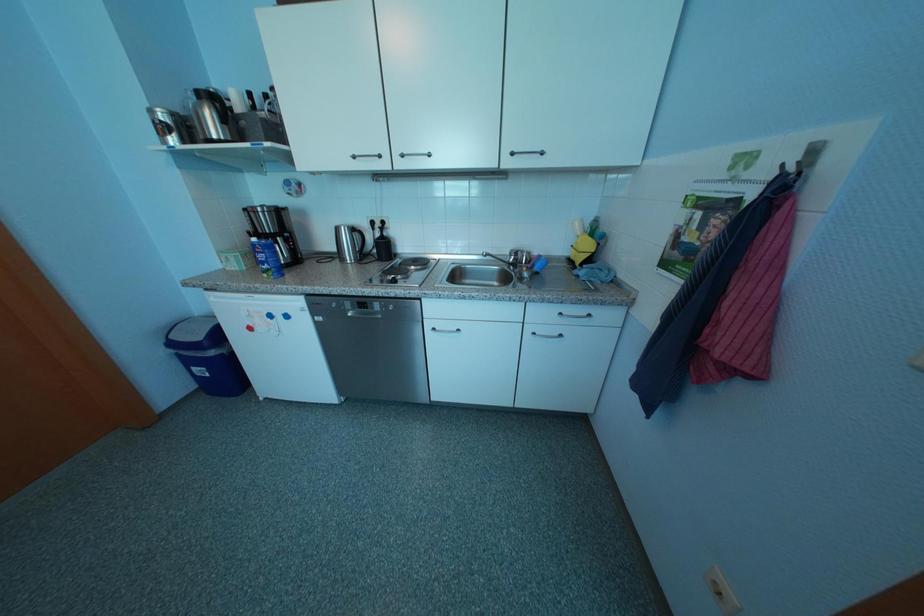
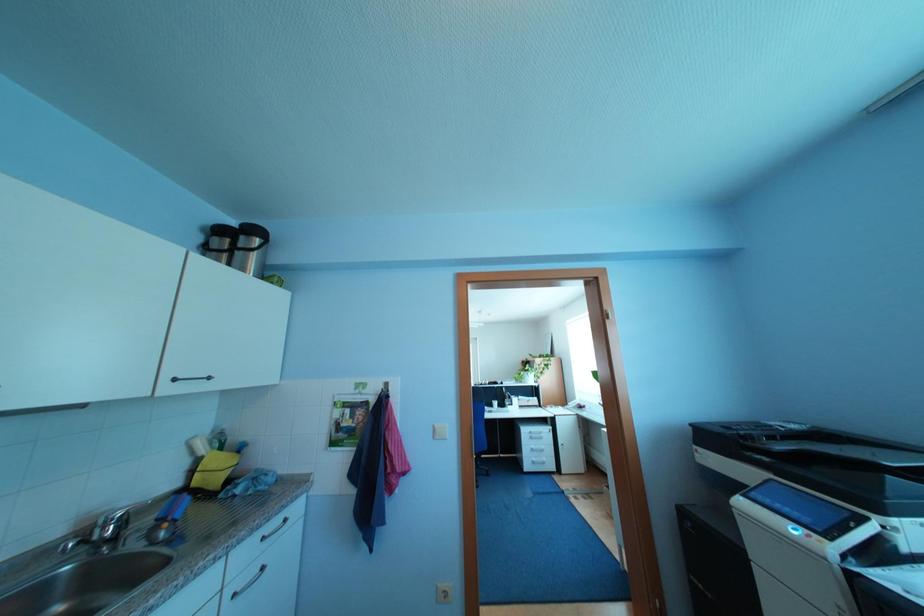
Question: The first image is from the beginning of the video and the second image is from the end. How did the camera likely rotate when shooting the video?

Choices:
 (A) Left
 (B) Right
 (C) Up
 (D) Down

Answer: (B)